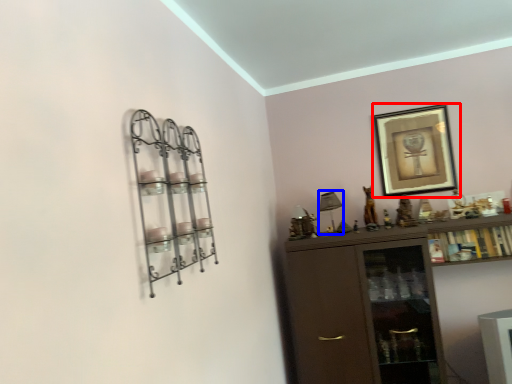
Question: Which object is closer to the camera taking this photo, picture frame (highlighted by a red box) or lamp (highlighted by a blue box)?

Choices:
 (A) picture frame
 (B) lamp

Answer: (B)